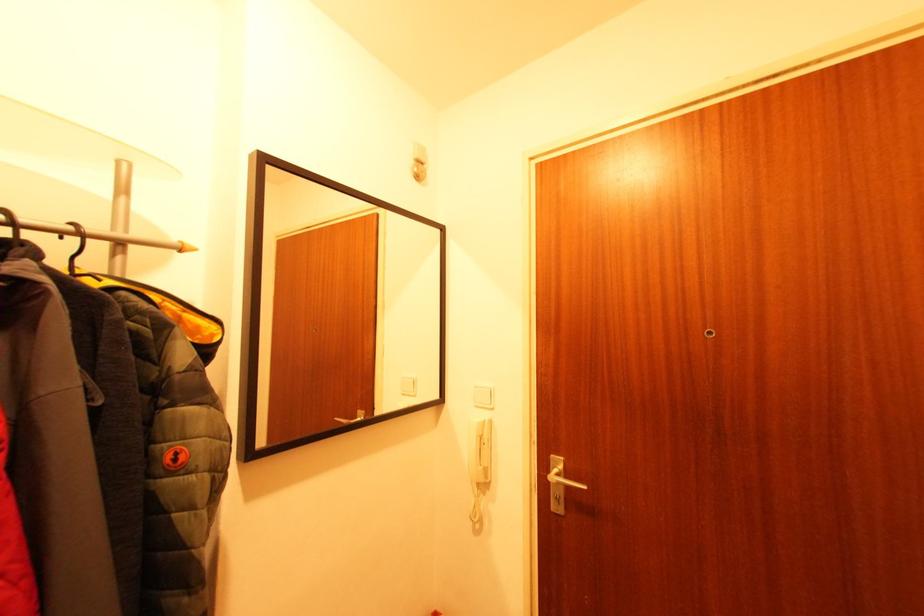
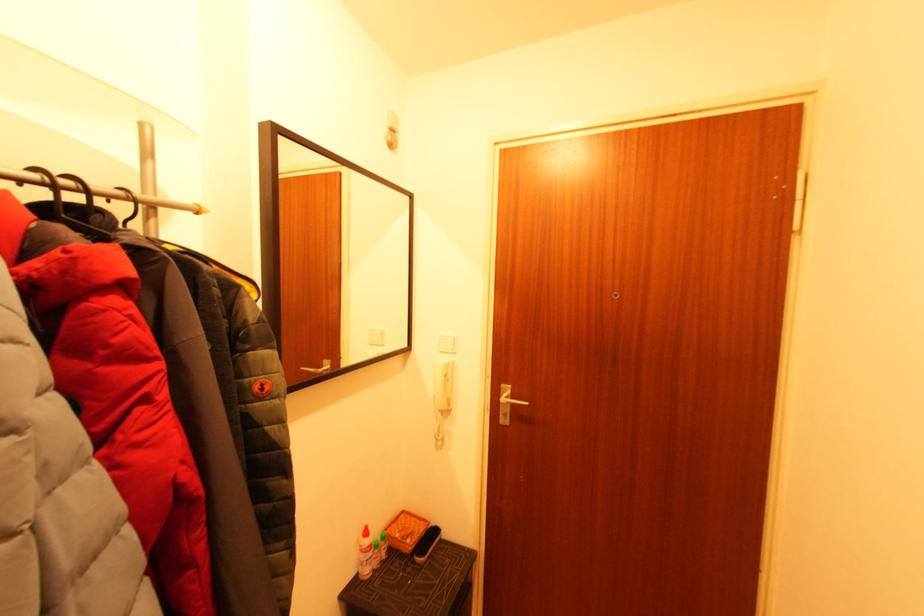
In the second image, find the point that corresponds to (x=556, y=456) in the first image.

(506, 387)